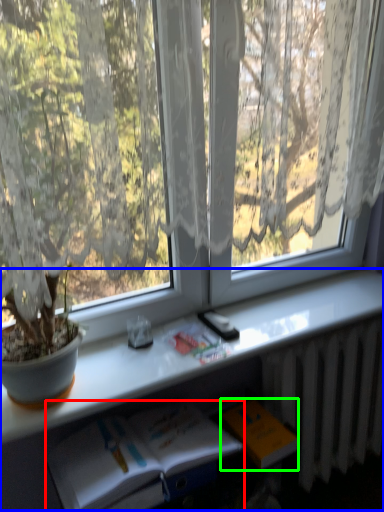
Question: Based on their relative distances, which object is farther from book (highlighted by a red box)? Choose from computer desk (highlighted by a blue box) and paperback book (highlighted by a green box).

Choices:
 (A) computer desk
 (B) paperback book

Answer: (B)